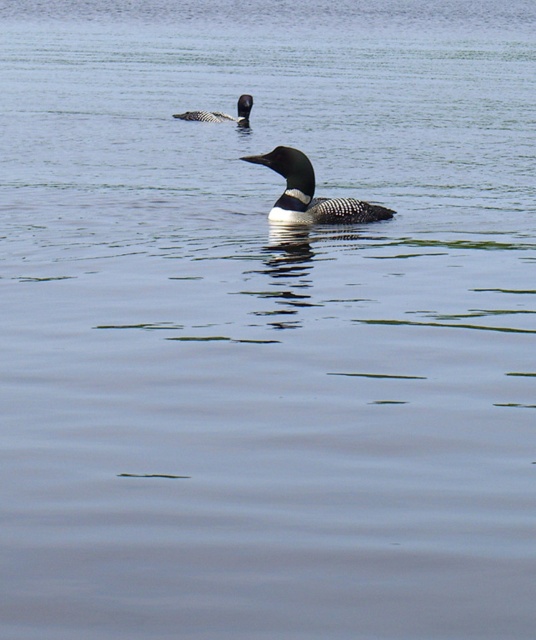
Question: Which point is farther to the camera?

Choices:
 (A) (286, 173)
 (B) (236, 109)

Answer: (B)

Question: Does greenish-gray feathers at center appear on the left side of dark gray matte duck at upper center?

Choices:
 (A) no
 (B) yes

Answer: (A)

Question: Which object is closer to the camera taking this photo?

Choices:
 (A) dark gray matte duck at upper center
 (B) greenish-gray feathers at center

Answer: (B)

Question: Where is greenish-gray feathers at center located in relation to dark gray matte duck at upper center in the image?

Choices:
 (A) right
 (B) left

Answer: (A)

Question: Does greenish-gray feathers at center appear on the left side of dark gray matte duck at upper center?

Choices:
 (A) yes
 (B) no

Answer: (B)

Question: Which of the following is the closest to the observer?

Choices:
 (A) dark gray matte duck at upper center
 (B) greenish-gray feathers at center

Answer: (B)